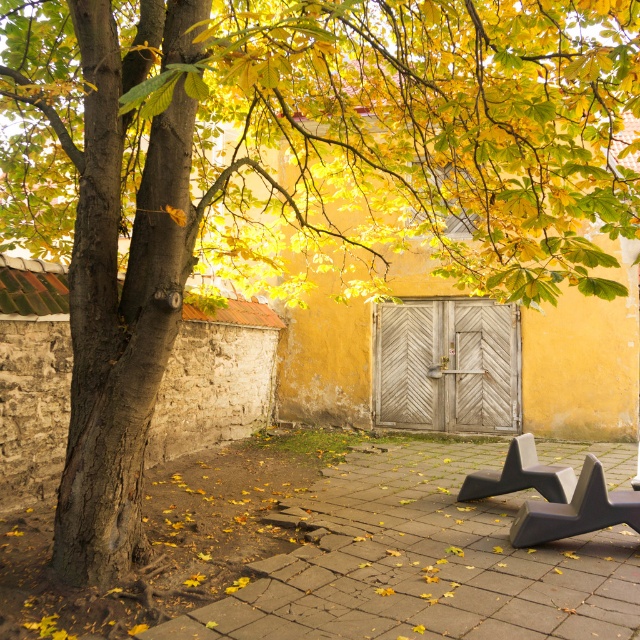
You are sitting on the smooth concrete bench at lower right and want to move to the gray concrete bench at center. Can you stand up and walk directly to it without moving around any obstacles?

The smooth concrete bench at lower right is positioned under the gray concrete bench at center, meaning the gray concrete bench is directly above it. Since they are stacked vertically, you cannot walk directly to it without moving around the bench above.

You are sitting on the smooth concrete bench at lower right and want to move to the gray concrete bench at center. Which direction should you move to reach it?

The smooth concrete bench at lower right is positioned on the left side of the gray concrete bench at center, so you should move to the right to reach it.